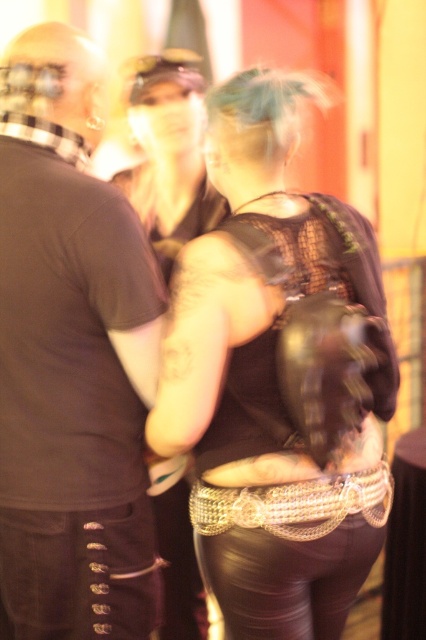
Question: Considering the real-world distances, which object is closest to the leather-like dark brown belt at lower left?

Choices:
 (A) matte black shirt at left
 (B) leather pants at center

Answer: (A)

Question: Which point appears closest to the camera in this image?

Choices:
 (A) (160, 160)
 (B) (63, 625)
 (C) (43, 262)

Answer: (C)

Question: Does leather pants at center lie in front of leather-like dark brown belt at lower left?

Choices:
 (A) no
 (B) yes

Answer: (A)

Question: From the image, what is the correct spatial relationship of matte black shirt at left in relation to leather pants at center?

Choices:
 (A) below
 (B) above

Answer: (A)

Question: Which object is the farthest from the leather pants at center?

Choices:
 (A) leather-like dark brown belt at lower left
 (B) matte black shirt at left

Answer: (A)

Question: Is matte black shirt at left above leather-like dark brown belt at lower left?

Choices:
 (A) yes
 (B) no

Answer: (A)